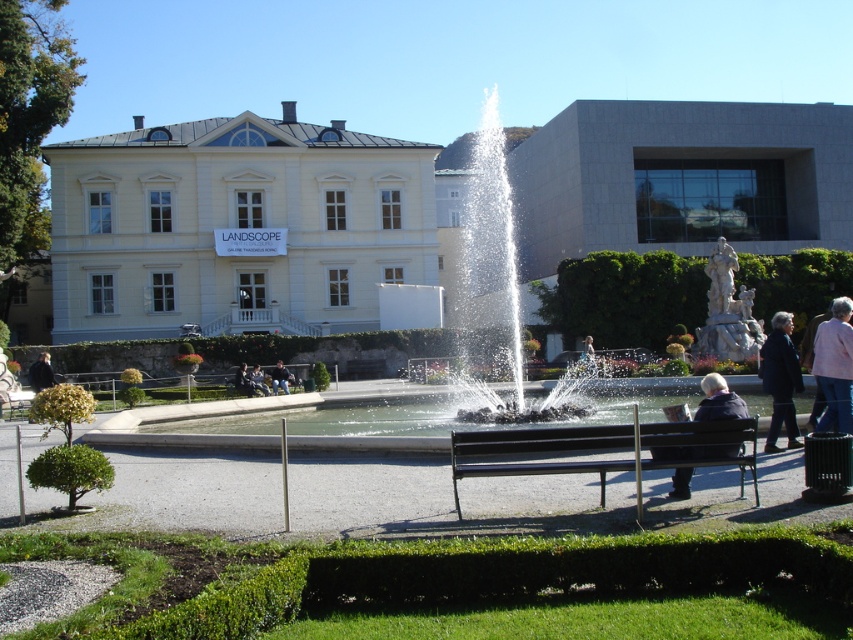
Is white marble statue at center smaller than dark blue coat at lower right?

No, white marble statue at center is not smaller than dark blue coat at lower right.

How far apart are white marble statue at center and dark blue coat at lower right?

white marble statue at center and dark blue coat at lower right are 46.04 feet apart from each other.

Does point (714, 307) come in front of point (780, 406)?

That is False.

Where is `white marble statue at center`? This screenshot has width=853, height=640. white marble statue at center is located at coordinates (727, 310).

How far apart are pink fabric jacket at lower right and dark blue jacket at lower left?

pink fabric jacket at lower right and dark blue jacket at lower left are 20.24 meters apart.

Which is in front, point (813, 352) or point (32, 372)?

Point (813, 352) is in front.

Does point (824, 323) come closer to viewer compared to point (47, 356)?

Yes, point (824, 323) is closer to viewer.

Identify the location of pink fabric jacket at lower right. (834, 365).

Which of these two, dark blue coat at lower right or light brown leather jacket at center, stands shorter?

light brown leather jacket at center is shorter.

Is dark blue coat at lower right wider than light brown leather jacket at center?

Yes, dark blue coat at lower right is wider than light brown leather jacket at center.

Does point (793, 355) come behind point (277, 358)?

No, it is not.

In order to click on dark blue coat at lower right in this screenshot , I will do `click(780, 380)`.